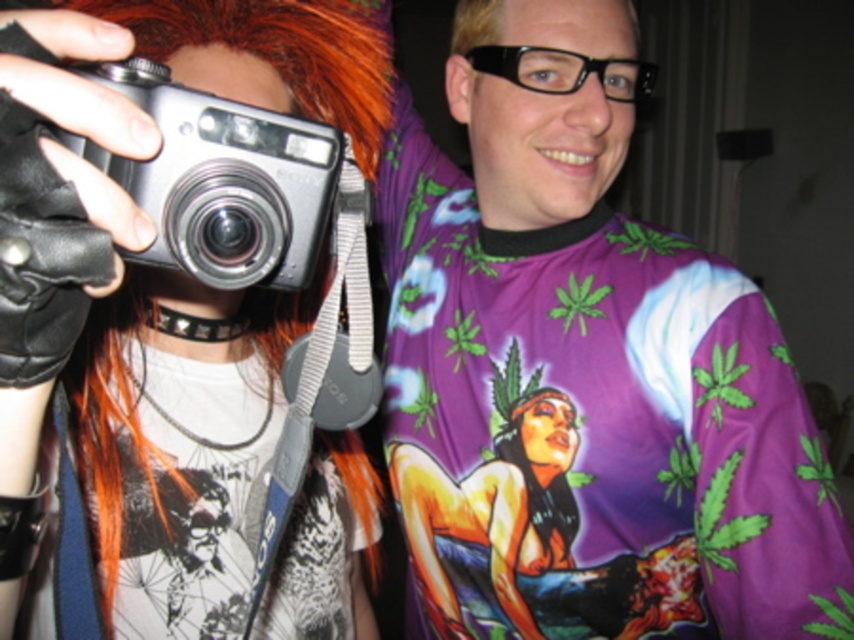
Question: Can you confirm if matte black camera at center is smaller than silver metallic camera at left?

Choices:
 (A) yes
 (B) no

Answer: (B)

Question: Can you confirm if matte black camera at center is positioned below silver metallic camera at left?

Choices:
 (A) no
 (B) yes

Answer: (B)

Question: In this image, where is matte black camera at center located relative to silver metallic camera at left?

Choices:
 (A) right
 (B) left

Answer: (B)

Question: Which point appears closest to the camera in this image?

Choices:
 (A) (190, 388)
 (B) (262, 115)

Answer: (B)